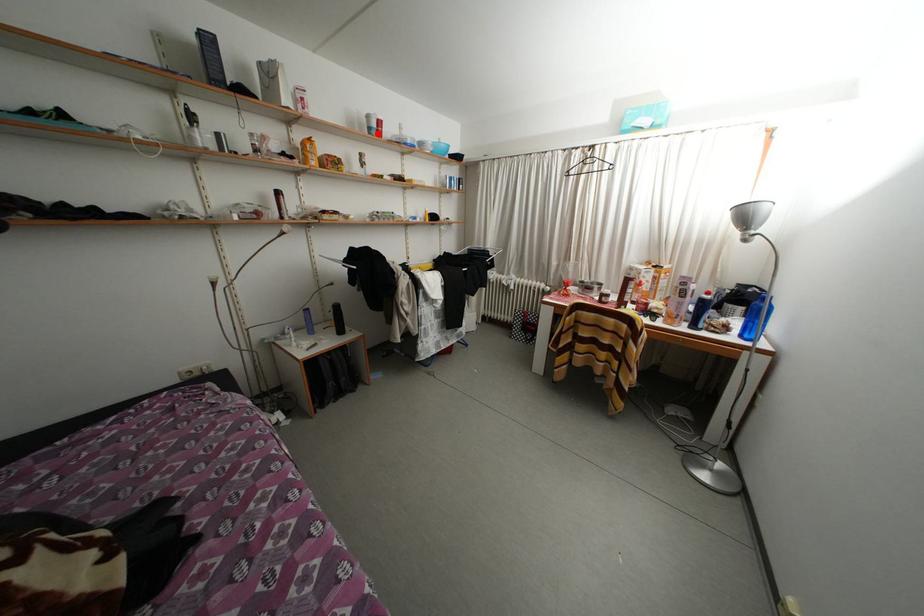
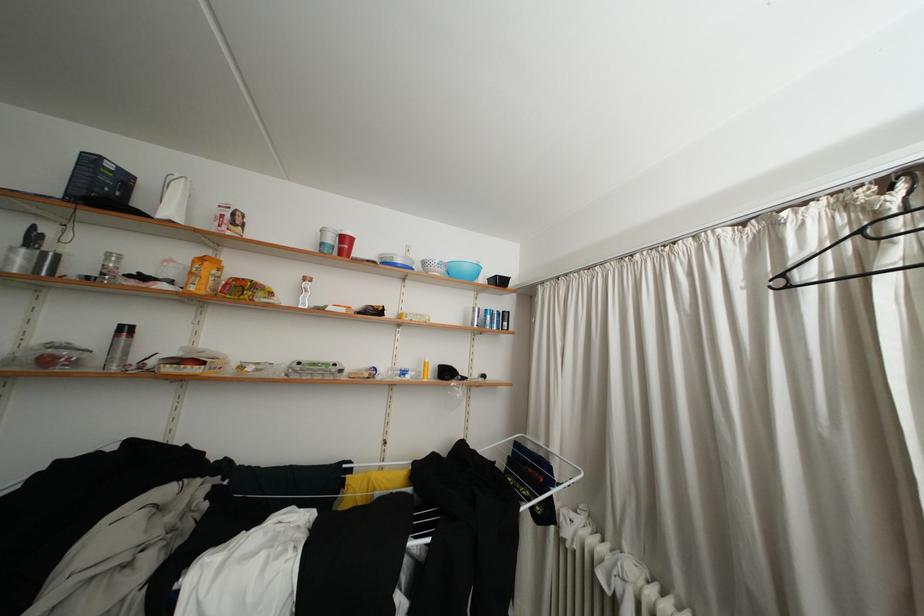
Locate, in the second image, the point that corresponds to the highlighted location in the first image.

(330, 249)